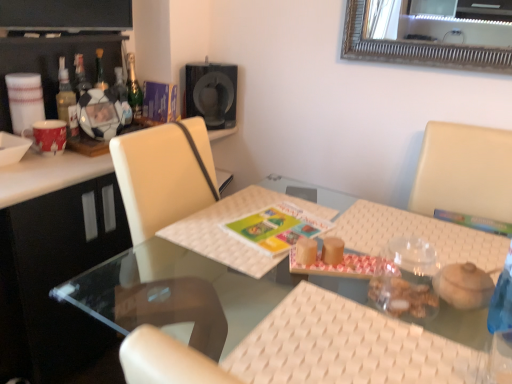
At what (x,y) coordinates should I click in order to perform the action: click on vacant area that lies to the right of red glossy mug at left. Please return your answer as a coordinate pair (x, y). The width and height of the screenshot is (512, 384). Looking at the image, I should click on (85, 159).